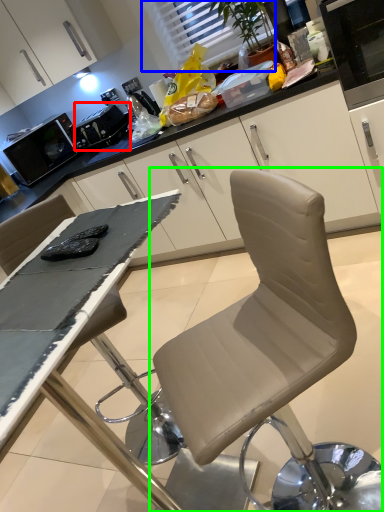
Question: Estimate the real-world distances between objects in this image. Which object is closer to appliance (highlighted by a red box), window (highlighted by a blue box) or chair (highlighted by a green box)?

Choices:
 (A) window
 (B) chair

Answer: (A)